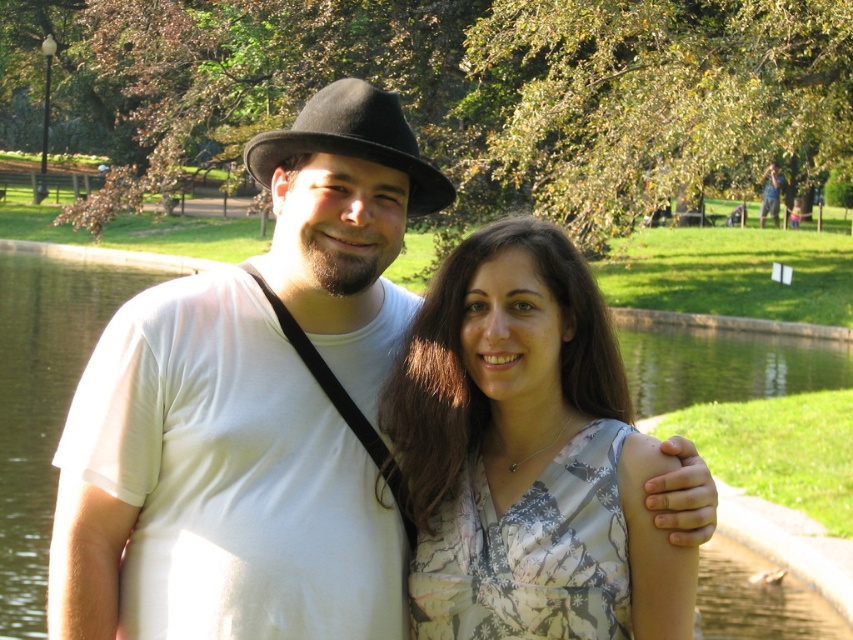
Question: Which point is closer to the camera?

Choices:
 (A) coord(190,300)
 (B) coord(694,570)

Answer: (B)

Question: Which object is the closest to the floral print blouse at center?

Choices:
 (A) white matte shirt at center
 (B) black felt fedora at center

Answer: (A)

Question: Is white matte shirt at center in front of black felt fedora at center?

Choices:
 (A) no
 (B) yes

Answer: (B)

Question: Is floral print blouse at center to the left of black felt fedora at center from the viewer's perspective?

Choices:
 (A) yes
 (B) no

Answer: (B)

Question: Which object is the farthest from the white matte shirt at center?

Choices:
 (A) black felt fedora at center
 (B) floral print blouse at center

Answer: (A)

Question: Can you confirm if floral print blouse at center is positioned to the right of black felt fedora at center?

Choices:
 (A) yes
 (B) no

Answer: (A)